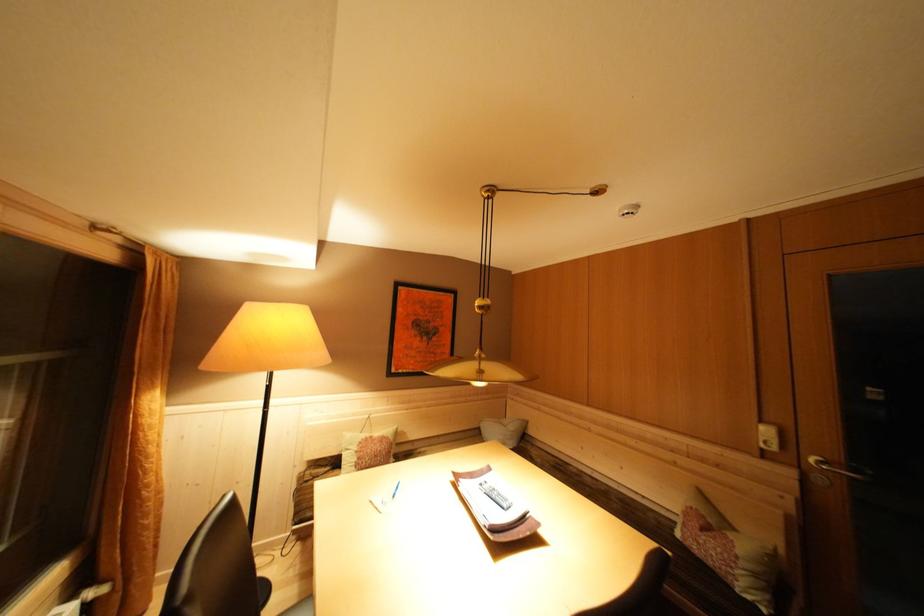
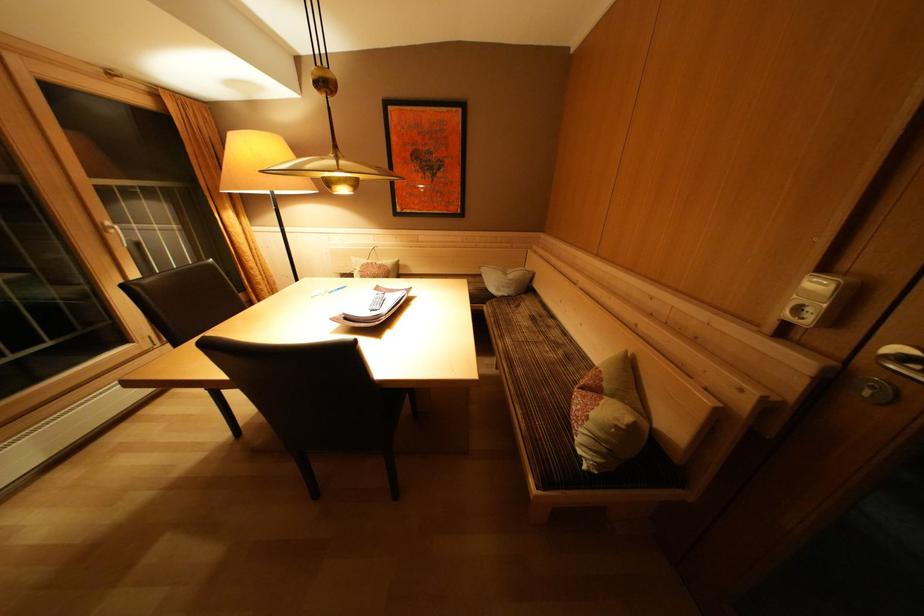
Where in the second image is the point corresponding to (746,557) from the first image?

(600, 419)